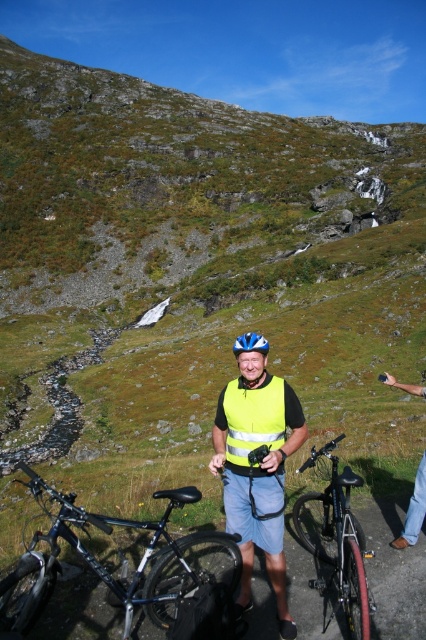
Does shiny black bike at center have a lesser width compared to blue matte helmet at center?

Indeed, shiny black bike at center has a lesser width compared to blue matte helmet at center.

Who is positioned more to the right, shiny black bike at center or blue matte helmet at center?

From the viewer's perspective, shiny black bike at center appears more on the right side.

The width and height of the screenshot is (426, 640). I want to click on shiny black bike at center, so click(x=336, y=538).

Identify the location of shiny black bike at center. (336, 538).

Which of these two, yellow reflective vest at center or blue glossy bicycle helmet at center, stands shorter?

yellow reflective vest at center is shorter.

Is yellow reflective vest at center below blue glossy bicycle helmet at center?

Yes.

Which is in front, point (253, 548) or point (241, 346)?

Point (241, 346) is more forward.

In order to click on yellow reflective vest at center in this screenshot , I will do `click(256, 468)`.

Which is above, yellow reflective vest at center or yellow reflective safety vest at center?

yellow reflective safety vest at center is higher up.

Does yellow reflective vest at center have a smaller size compared to yellow reflective safety vest at center?

Indeed, yellow reflective vest at center has a smaller size compared to yellow reflective safety vest at center.

Locate an element on the screen. The width and height of the screenshot is (426, 640). yellow reflective vest at center is located at coordinates (256, 468).